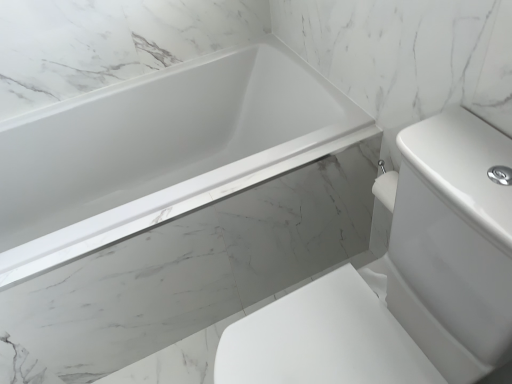
Question: Is white glossy sink at center at the back of white glossy bathtub at upper left?

Choices:
 (A) yes
 (B) no

Answer: (B)

Question: Considering the relative sizes of white glossy bathtub at upper left and white glossy sink at center in the image provided, is white glossy bathtub at upper left thinner than white glossy sink at center?

Choices:
 (A) yes
 (B) no

Answer: (A)

Question: Is white glossy bathtub at upper left smaller than white glossy sink at center?

Choices:
 (A) yes
 (B) no

Answer: (B)

Question: Is white glossy bathtub at upper left positioned far away from white glossy sink at center?

Choices:
 (A) yes
 (B) no

Answer: (B)

Question: Is white glossy bathtub at upper left next to white glossy sink at center?

Choices:
 (A) yes
 (B) no

Answer: (B)

Question: Is the depth of white glossy bathtub at upper left greater than that of white glossy sink at center?

Choices:
 (A) no
 (B) yes

Answer: (B)

Question: Can you confirm if white glossy sink at center is smaller than white glossy bathtub at upper left?

Choices:
 (A) no
 (B) yes

Answer: (B)

Question: Considering the relative positions of white glossy sink at center and white glossy bathtub at upper left in the image provided, is white glossy sink at center to the left of white glossy bathtub at upper left from the viewer's perspective?

Choices:
 (A) no
 (B) yes

Answer: (A)

Question: Could you tell me if white glossy sink at center is turned towards white glossy bathtub at upper left?

Choices:
 (A) yes
 (B) no

Answer: (B)

Question: Is white glossy sink at center turned away from white glossy bathtub at upper left?

Choices:
 (A) no
 (B) yes

Answer: (A)

Question: Does white glossy sink at center have a greater width compared to white glossy bathtub at upper left?

Choices:
 (A) no
 (B) yes

Answer: (B)

Question: Is white glossy sink at center located outside white glossy bathtub at upper left?

Choices:
 (A) no
 (B) yes

Answer: (B)

Question: Is point (417, 254) closer or farther from the camera than point (207, 132)?

Choices:
 (A) closer
 (B) farther

Answer: (A)